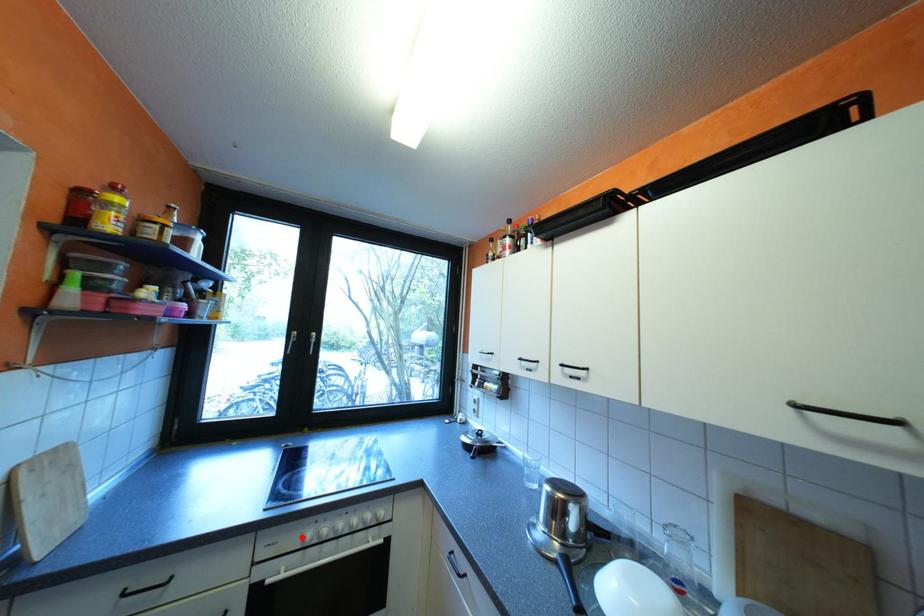
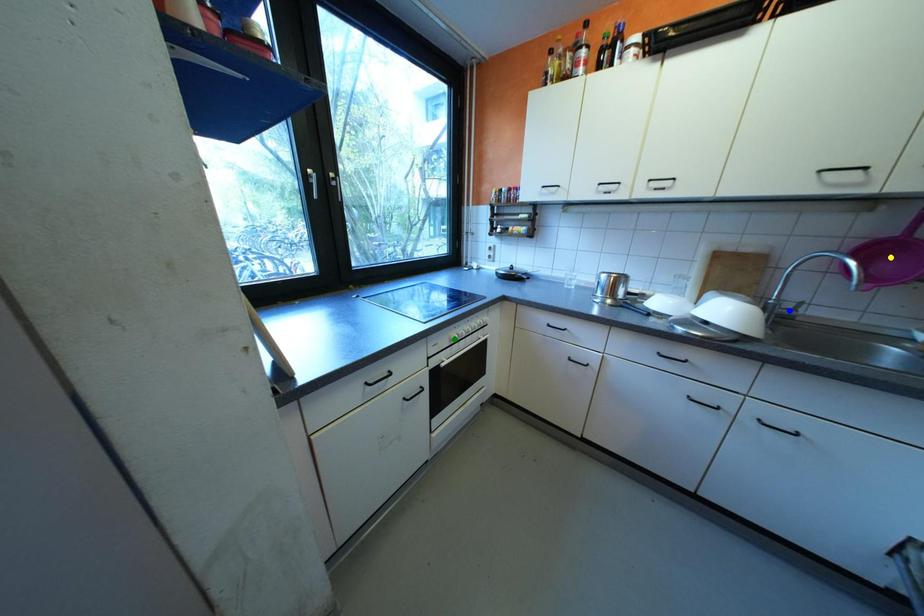
Question: I am providing you with two images of the same scene from different viewpoints. A red point is marked on the first image. You are given multiple points on the second image. Can you choose the point in image 2 that corresponds to the point in image 1?

Choices:
 (A) blue point
 (B) green point
 (C) yellow point

Answer: (B)